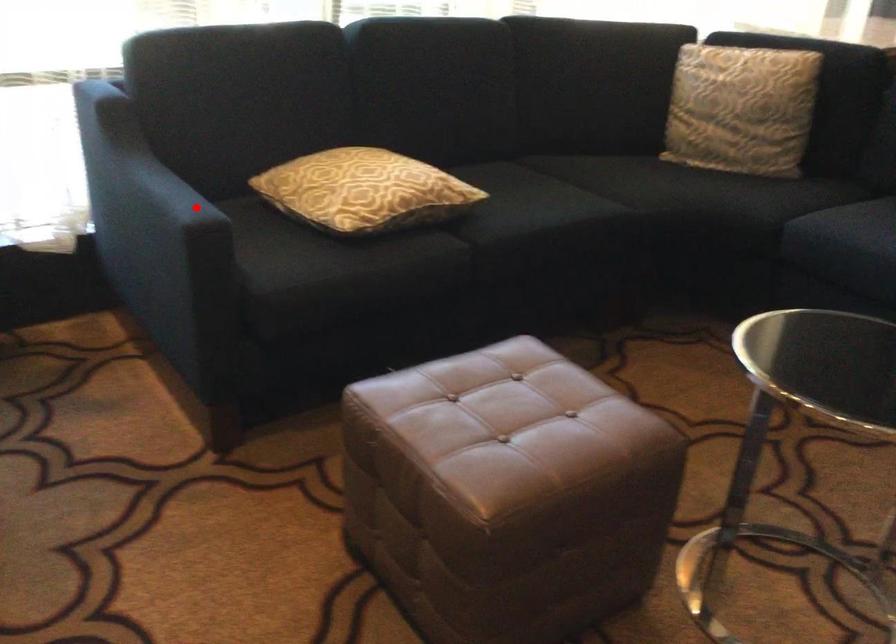
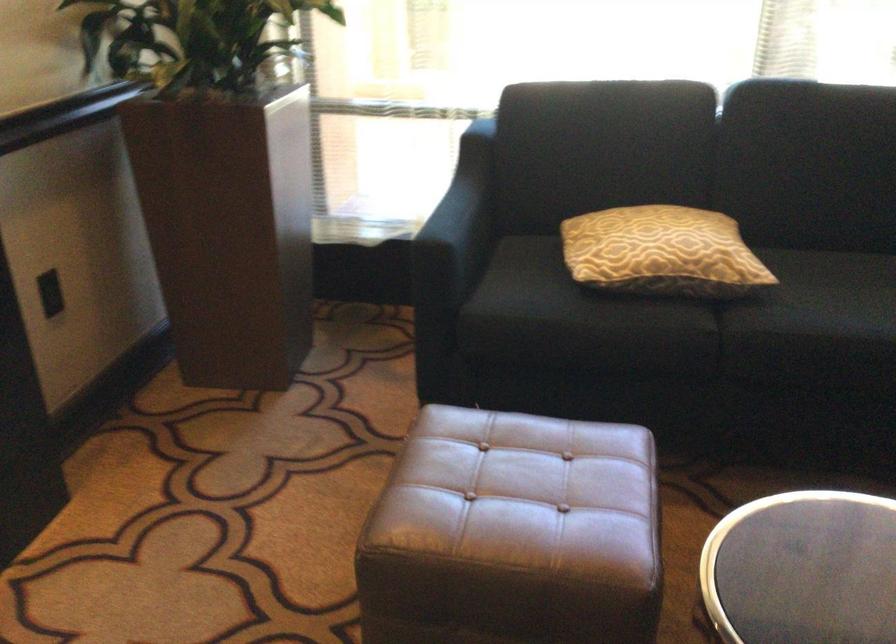
The point at the highlighted location is marked in the first image. Where is the corresponding point in the second image?

(458, 225)